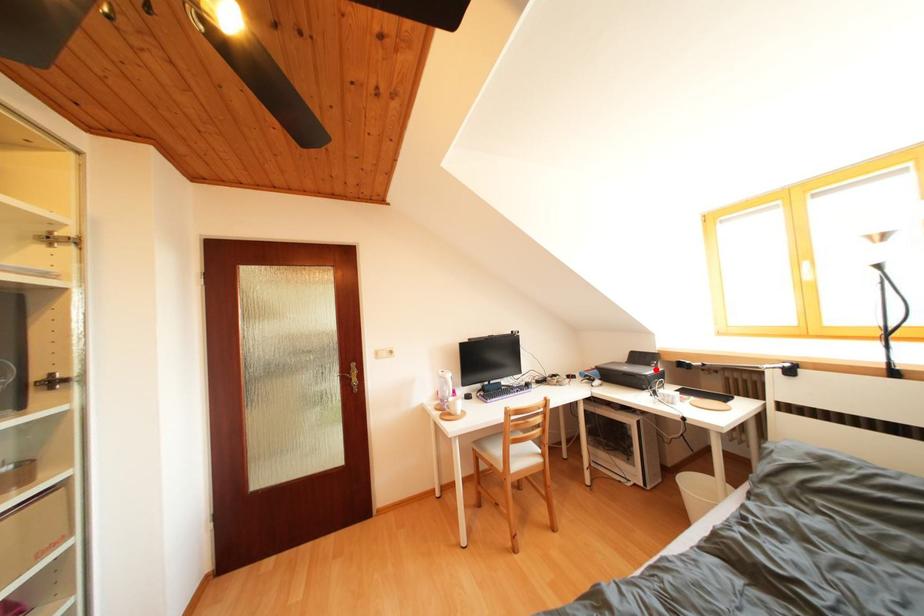
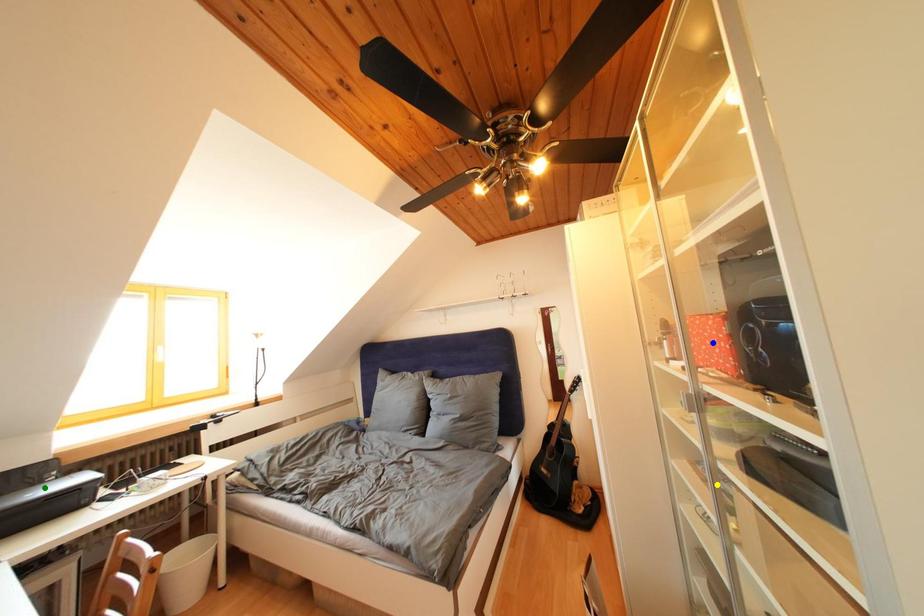
Question: I am providing you with two images of the same scene from different viewpoints. A red point is marked on the first image. You are given multiple points on the second image. Can you choose the point in image 2 that corresponds to the point in image 1?

Choices:
 (A) blue point
 (B) green point
 (C) yellow point

Answer: (B)